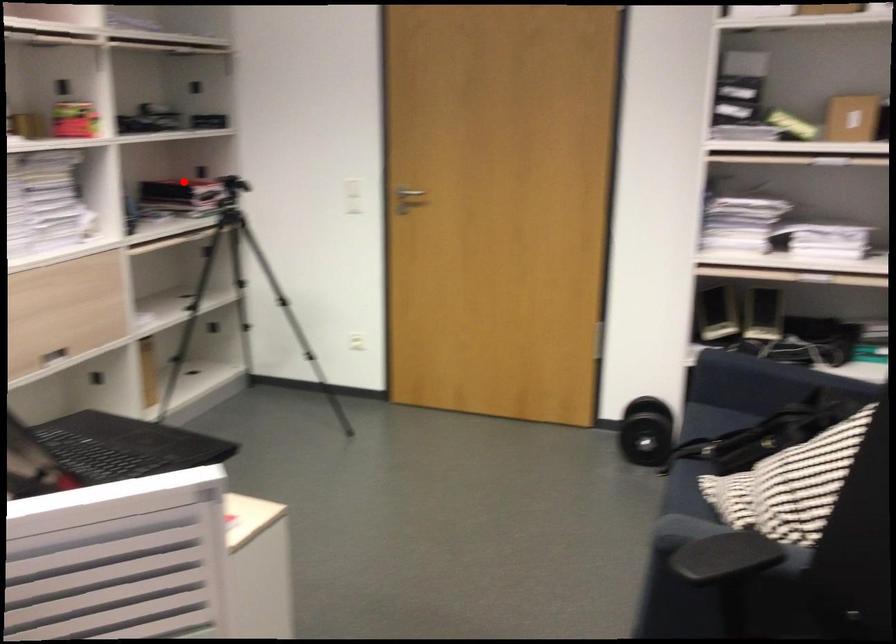
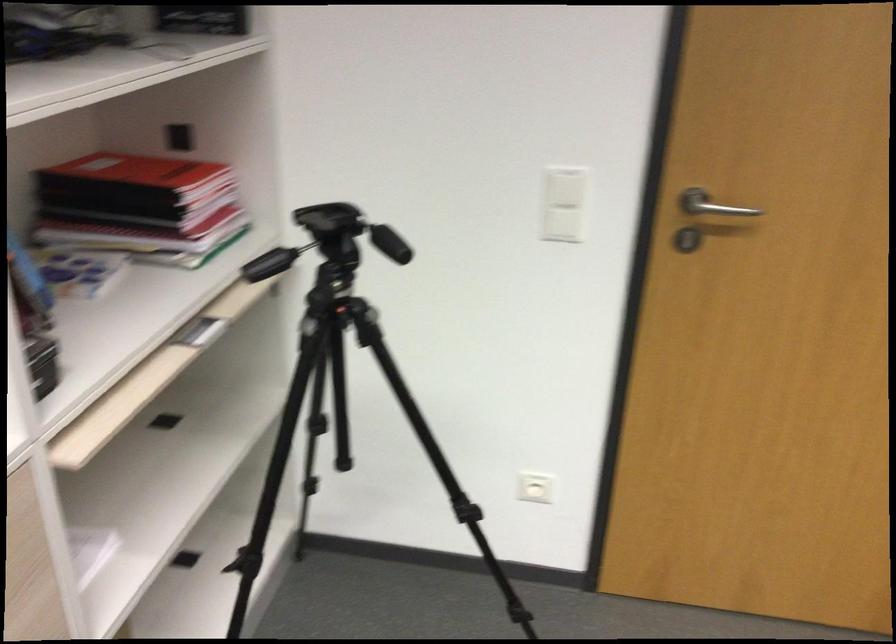
Where in the second image is the point corresponding to the highlighted location from the first image?

(133, 172)